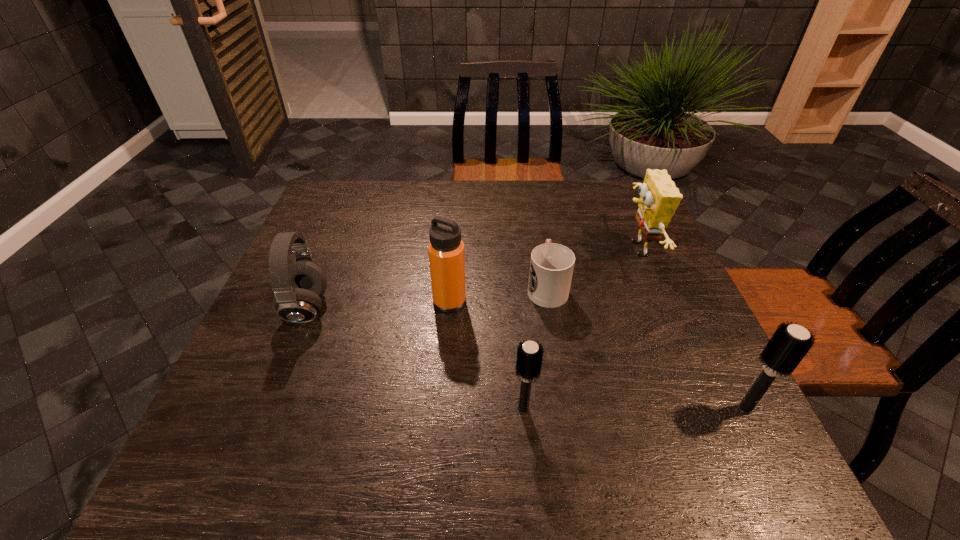
Find the location of a particular element. The width and height of the screenshot is (960, 540). vacant space located 0.240m on the left of the rightmost object is located at coordinates (606, 409).

Image resolution: width=960 pixels, height=540 pixels. Identify the location of vacant space located on the face of the second object from right to left. coord(503,249).

Where is `vacant space located 0.290m on the face of the second object from right to left`? vacant space located 0.290m on the face of the second object from right to left is located at coordinates (515, 249).

Identify the location of vacant space located on the face of the second object from right to left. This screenshot has height=540, width=960. (568, 249).

Where is `vacant space located on the right of the second object from left to right`? vacant space located on the right of the second object from left to right is located at coordinates (537, 302).

Find the location of a particular element. free space located on the ear cups of the headset is located at coordinates [430, 308].

In order to click on vacant space positioned on the side of the third object from right to left where the handle is located in this screenshot , I will do `click(540, 245)`.

At what (x,y) coordinates should I click in order to perform the action: click on free space located on the side of the third object from right to left where the handle is located. Please return your answer as a coordinate pair (x, y). Looking at the image, I should click on (534, 204).

In order to click on vacant space situated 0.110m on the side of the third object from right to left where the handle is located in this screenshot , I will do `click(540, 242)`.

Find the location of a particular element. Image resolution: width=960 pixels, height=540 pixels. object located in the far edge section of the desktop is located at coordinates 659,197.